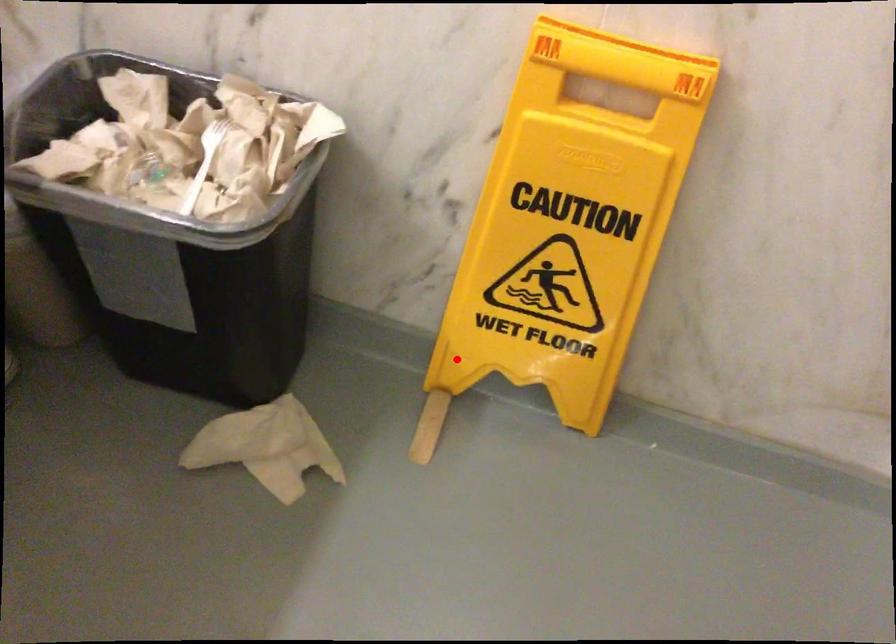
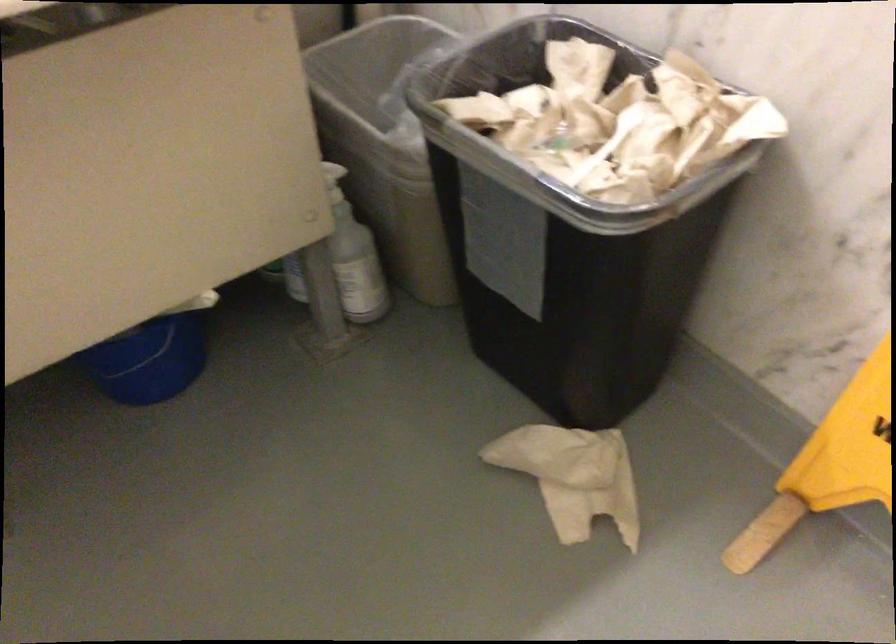
Question: I am providing you with two images of the same scene from different viewpoints. A red point is shown in image1. For the corresponding object point in image2, is it positioned nearer or farther from the camera?

Choices:
 (A) Nearer
 (B) Farther

Answer: (A)